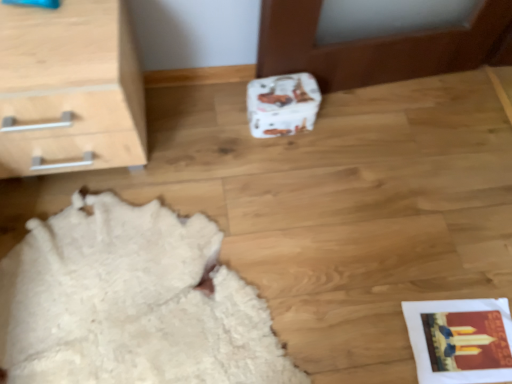
This screenshot has width=512, height=384. I want to click on empty space that is in between light wood/texture chest of drawers at upper left and white paper shoe box at center, so click(x=208, y=125).